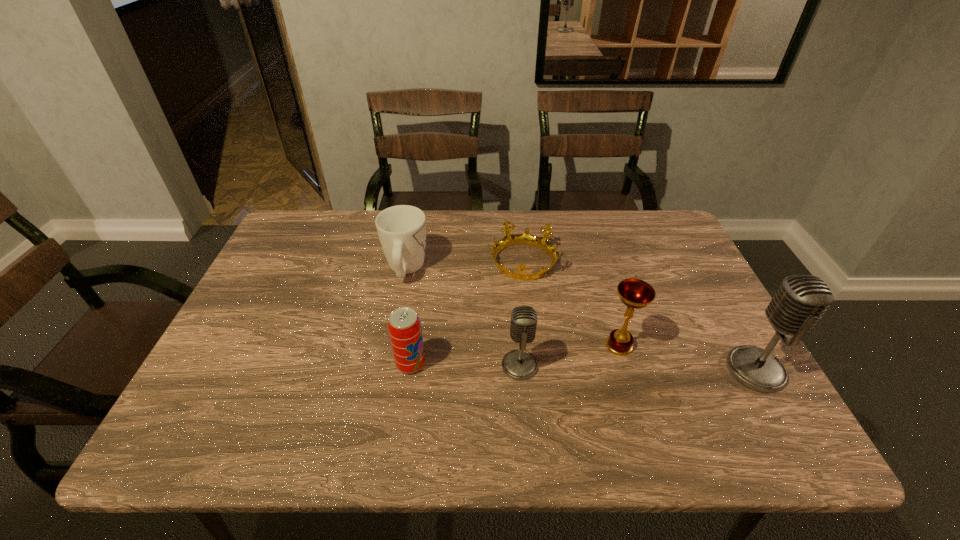
Where is `vacant space that satisfies the following two spatial constraints: 1. on the front side of the right microphone; 2. on the right side of the crown`? The width and height of the screenshot is (960, 540). vacant space that satisfies the following two spatial constraints: 1. on the front side of the right microphone; 2. on the right side of the crown is located at coordinates (535, 370).